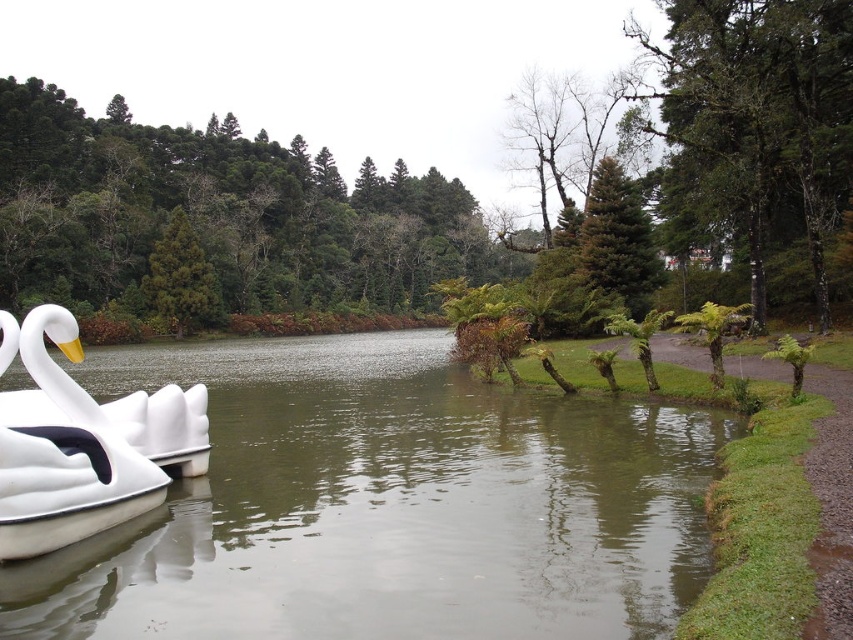
Between green smooth water at left and white matte swan at left, which one has less height?

green smooth water at left

This screenshot has height=640, width=853. In order to click on green smooth water at left in this screenshot , I will do `click(387, 506)`.